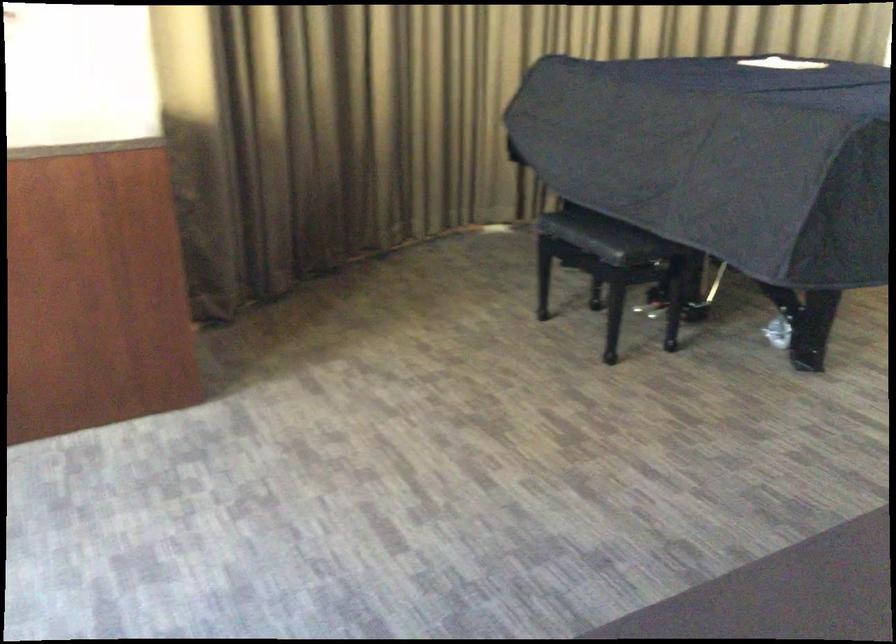
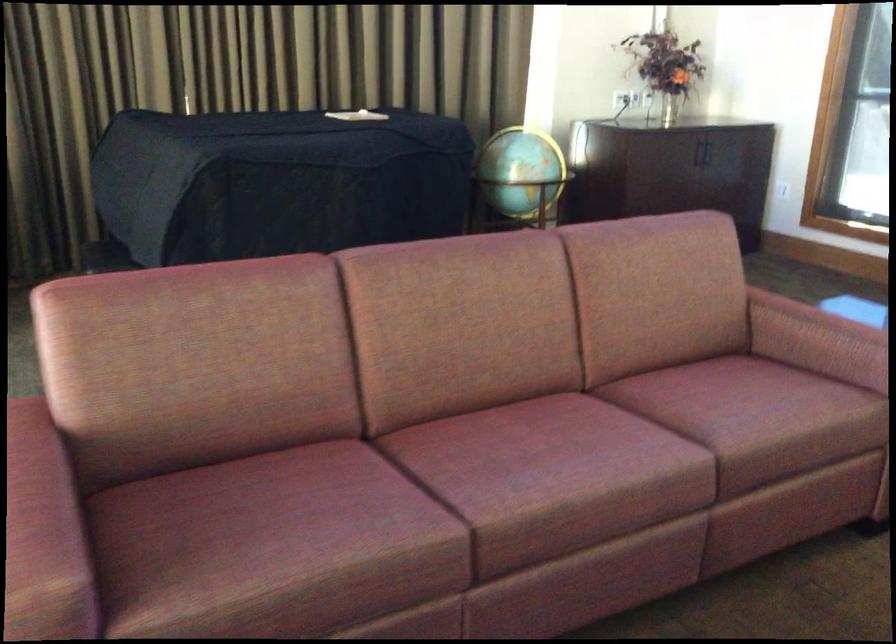
Question: The images are taken continuously from a first-person perspective. In which direction are you moving?

Choices:
 (A) Left
 (B) Right
 (C) Forward
 (D) Backward

Answer: (B)